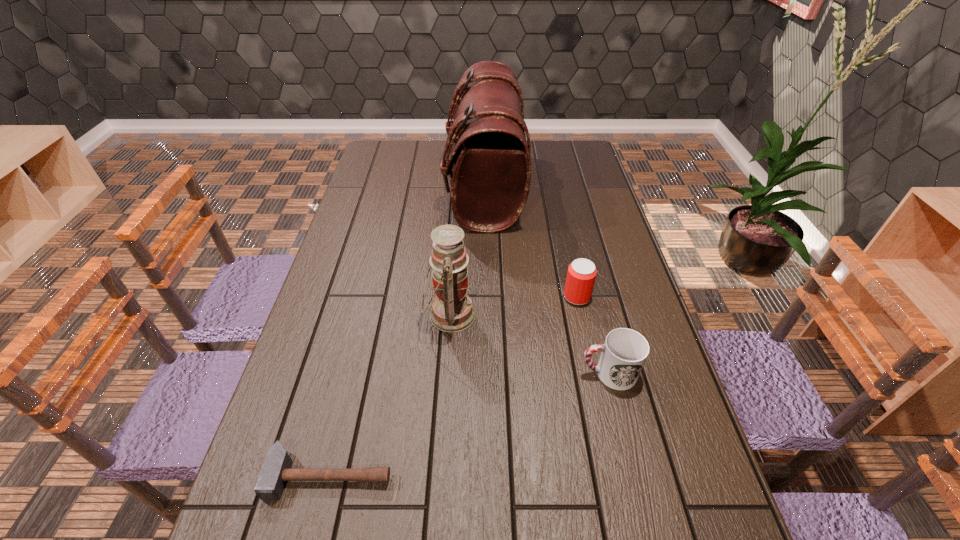
Locate an element on the screen. This screenshot has height=540, width=960. free point between the oil lamp and the farthest object is located at coordinates (467, 252).

At what (x,y) coordinates should I click in order to perform the action: click on free spot between the tallest object and the nearest object. Please return your answer as a coordinate pair (x, y). The height and width of the screenshot is (540, 960). Looking at the image, I should click on (407, 332).

Image resolution: width=960 pixels, height=540 pixels. I want to click on vacant space that's between the farthest object and the second tallest object, so click(x=467, y=252).

Locate which object ranks in proximity to the second tallest object. Please provide its 2D coordinates. Your answer should be formatted as a tuple, i.e. [(x, y)], where the tuple contains the x and y coordinates of a point satisfying the conditions above.

[(581, 275)]

The image size is (960, 540). Identify the location of object that is the second closest to the second tallest object. [491, 160].

You are a GUI agent. You are given a task and a screenshot of the screen. Output one action in this format:
    pyautogui.click(x=<x>, y=<y>)
    Task: Click on the free location that satisfies the following two spatial constraints: 1. on the handle side of the cup; 2. on the front side of the second tallest object
    
    Given the screenshot: What is the action you would take?
    pyautogui.click(x=594, y=315)

Find the location of a particular element. This screenshot has width=960, height=540. vacant area in the image that satisfies the following two spatial constraints: 1. on the back side of the beer can; 2. on the left side of the oil lamp is located at coordinates (451, 296).

At what (x,y) coordinates should I click in order to perform the action: click on blank area in the image that satisfies the following two spatial constraints: 1. on the front-facing side of the beer can; 2. on the right side of the tallest object. Please return your answer as a coordinate pair (x, y). The width and height of the screenshot is (960, 540). Looking at the image, I should click on (486, 296).

Where is `vacant space that satisfies the following two spatial constraints: 1. on the handle side of the cup; 2. on the front-facing side of the tallest object`? This screenshot has width=960, height=540. vacant space that satisfies the following two spatial constraints: 1. on the handle side of the cup; 2. on the front-facing side of the tallest object is located at coordinates (564, 189).

Where is `vacant space that satisfies the following two spatial constraints: 1. on the front-facing side of the beer can; 2. on the left side of the satchel`? vacant space that satisfies the following two spatial constraints: 1. on the front-facing side of the beer can; 2. on the left side of the satchel is located at coordinates (486, 296).